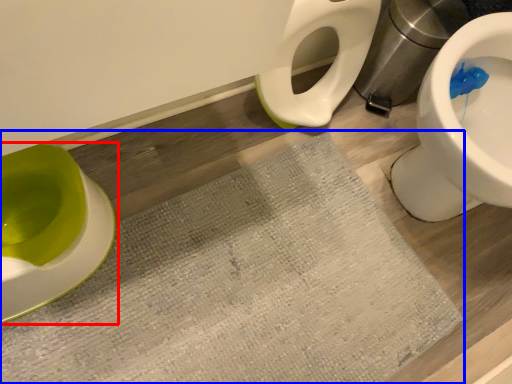
Question: Which object appears farthest to the camera in this image, toilet (highlighted by a red box) or bath mat (highlighted by a blue box)?

Choices:
 (A) toilet
 (B) bath mat

Answer: (B)